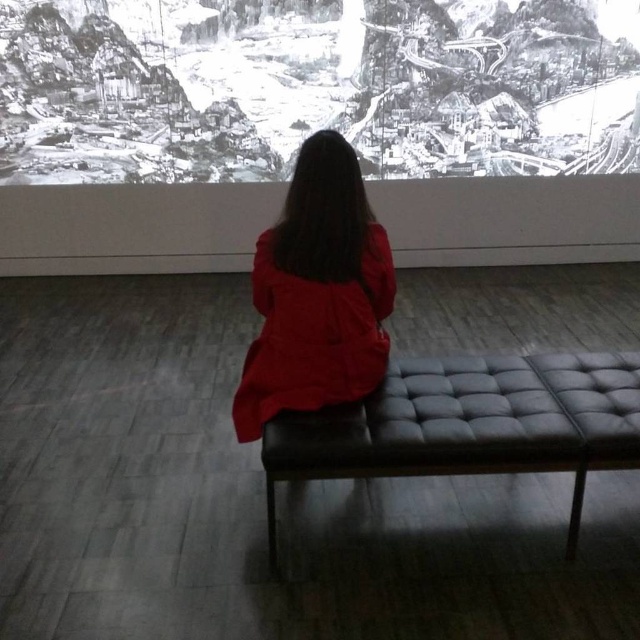
The width and height of the screenshot is (640, 640). What are the coordinates of `leather-like black bench at center` in the screenshot? It's located at (x=468, y=424).

In the scene shown: Is leather-like black bench at center thinner than red matte coat at center?

In fact, leather-like black bench at center might be wider than red matte coat at center.

The image size is (640, 640). I want to click on leather-like black bench at center, so click(x=468, y=424).

Where is `leather-like black bench at center`? The image size is (640, 640). leather-like black bench at center is located at coordinates click(468, 424).